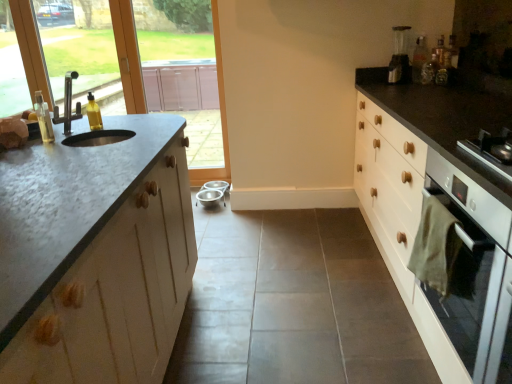
Question: Does point (96, 105) appear closer or farther from the camera than point (47, 135)?

Choices:
 (A) closer
 (B) farther

Answer: (B)

Question: In the image, is yellow translucent bottle at left, which is counted as the second bottle, starting from the left, on the left side or the right side of translucent plastic soap dispenser at left, the 3th bottle positioned from the back?

Choices:
 (A) left
 (B) right

Answer: (B)

Question: Estimate the real-world distances between objects in this image. Which object is farther from the yellow translucent bottle at left, the second bottle in the bottom-to-top sequence?

Choices:
 (A) transparent glass window at upper left, arranged as the first window screen when viewed from the left
 (B) stainless steel sink at left
 (C) translucent plastic bottle at upper right, which is counted as the third bottle, starting from the bottom
 (D) metallic silver coffee machine at upper right
 (E) matte glass window screen at upper left, the 1th window screen from the right

Answer: (A)

Question: Estimate the real-world distances between objects in this image. Which object is closer to the translucent plastic soap dispenser at left, the 3th bottle positioned from the back?

Choices:
 (A) metallic silver coffee machine at upper right
 (B) metallic stainless steel bowls at center
 (C) white glossy oven at right
 (D) matte glass window screen at upper left, the 1th window screen from the right
 (E) stainless steel sink at left

Answer: (E)